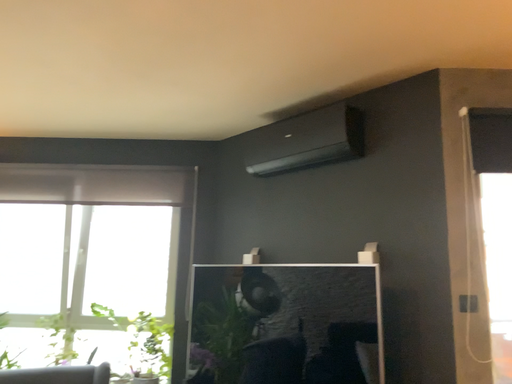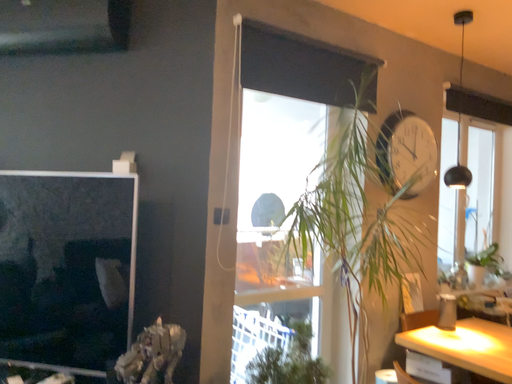
Question: Which way did the camera rotate in the video?

Choices:
 (A) rotated downward
 (B) rotated upward

Answer: (A)